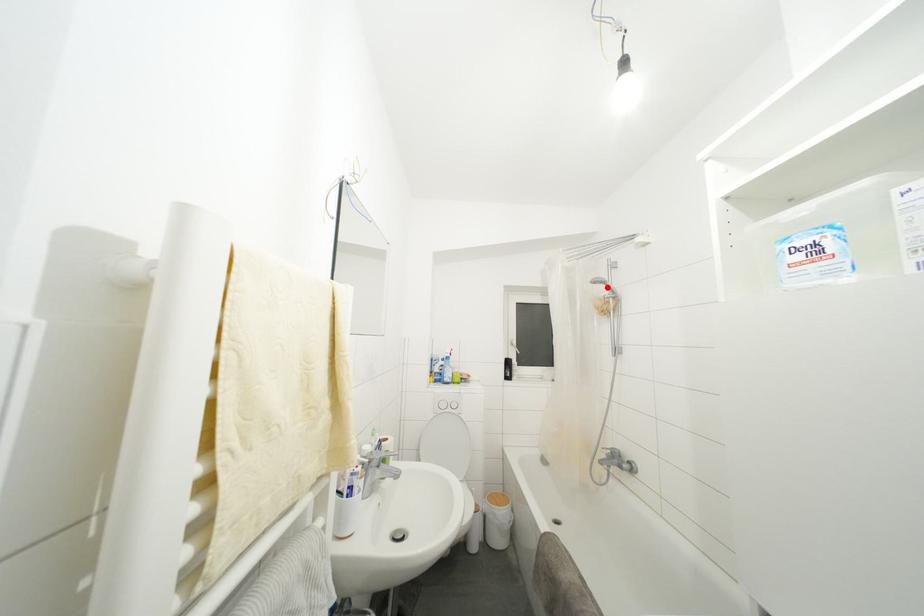
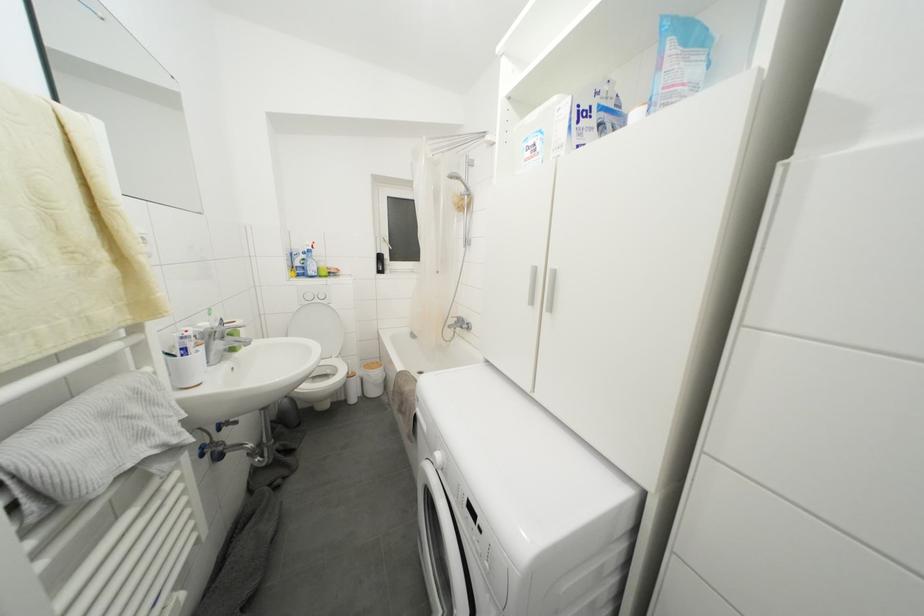
The point at the highlighted location is marked in the first image. Where is the corresponding point in the second image?

(463, 182)